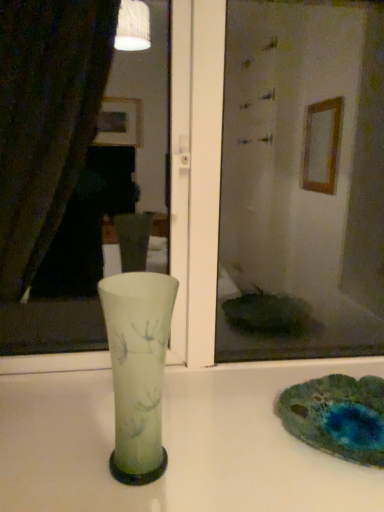
At what (x,y) coordinates should I click in order to perform the action: click on free space above white glossy vase at center (from a real-world perspective). Please return your answer as a coordinate pair (x, y). Looking at the image, I should click on (209, 438).